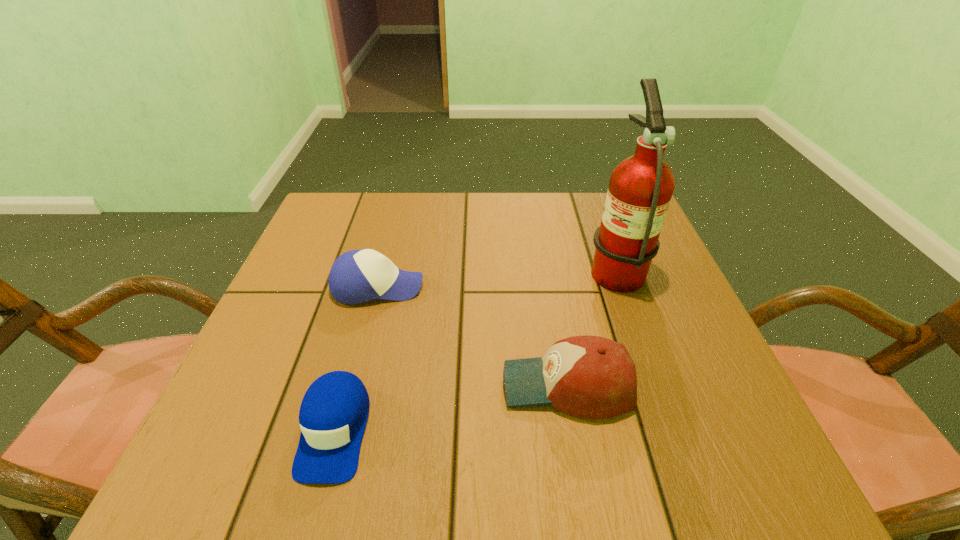
The height and width of the screenshot is (540, 960). Find the location of `free spot between the fire extinguisher and the farthest baseball cap`. free spot between the fire extinguisher and the farthest baseball cap is located at coordinates (496, 277).

Where is `unoccupied area between the tallest object and the shortest baseball cap`? The width and height of the screenshot is (960, 540). unoccupied area between the tallest object and the shortest baseball cap is located at coordinates (474, 348).

Where is `object that is the second closest to the shortest baseball cap`? object that is the second closest to the shortest baseball cap is located at coordinates (593, 377).

Locate which object is the third closest to the shortest object. Please provide its 2D coordinates. Your answer should be formatted as a tuple, i.e. [(x, y)], where the tuple contains the x and y coordinates of a point satisfying the conditions above.

[(640, 189)]

Select which baseball cap appears as the closest to the rightmost baseball cap. Please provide its 2D coordinates. Your answer should be formatted as a tuple, i.e. [(x, y)], where the tuple contains the x and y coordinates of a point satisfying the conditions above.

[(357, 276)]

Find the location of a particular element. This screenshot has height=540, width=960. baseball cap object that ranks as the second closest to the second tallest object is located at coordinates (333, 414).

Locate an element on the screen. The width and height of the screenshot is (960, 540). free space that satisfies the following two spatial constraints: 1. on the front-facing side of the farthest baseball cap; 2. on the front-facing side of the shortest baseball cap is located at coordinates (341, 430).

Identify the location of free space that satisfies the following two spatial constraints: 1. on the front-facing side of the farthest baseball cap; 2. on the front-facing side of the shortest object. The width and height of the screenshot is (960, 540). (341, 430).

This screenshot has width=960, height=540. I want to click on vacant area in the image that satisfies the following two spatial constraints: 1. on the front-facing side of the rightmost baseball cap; 2. on the front-facing side of the shortest baseball cap, so click(x=575, y=430).